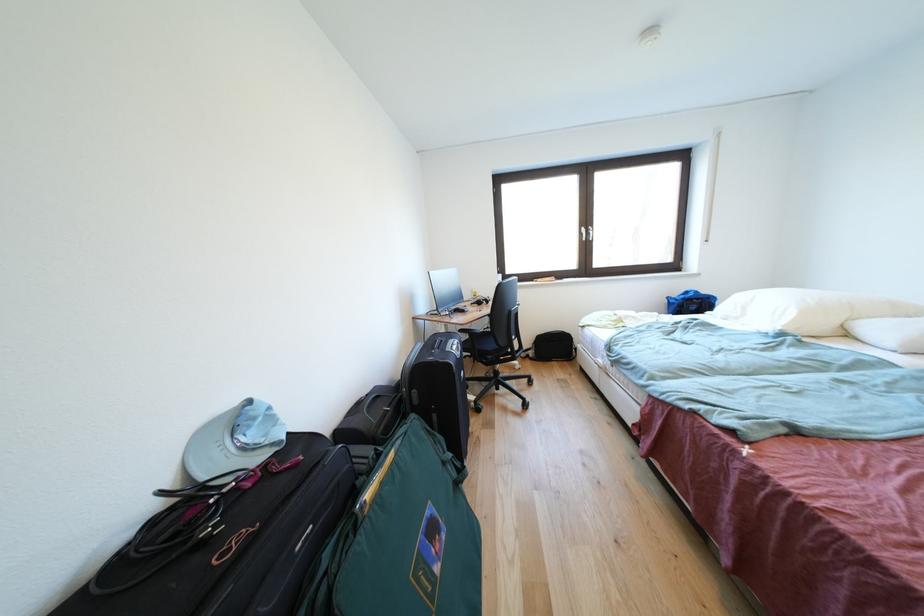
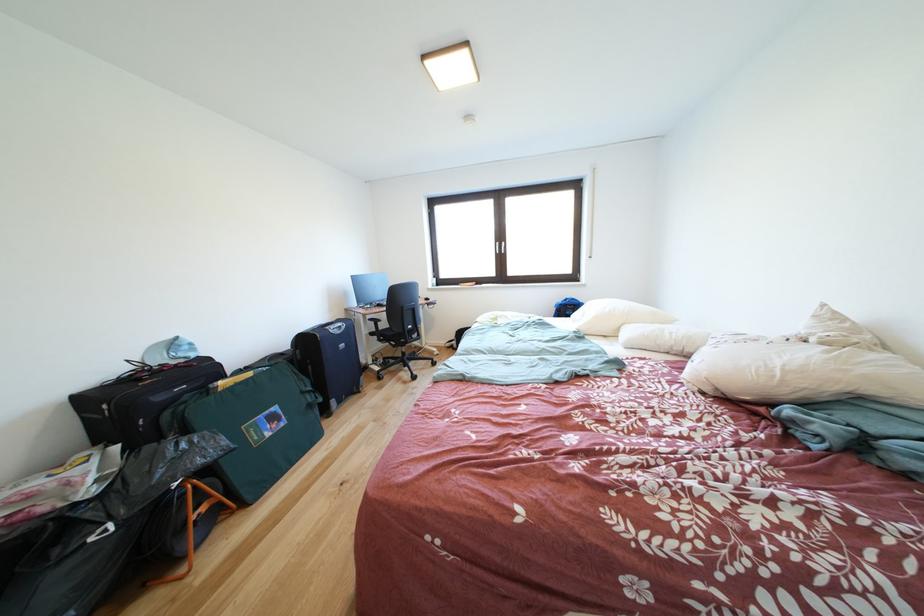
Where in the second image is the point corresponding to point 495,369 from the first image?

(403, 351)